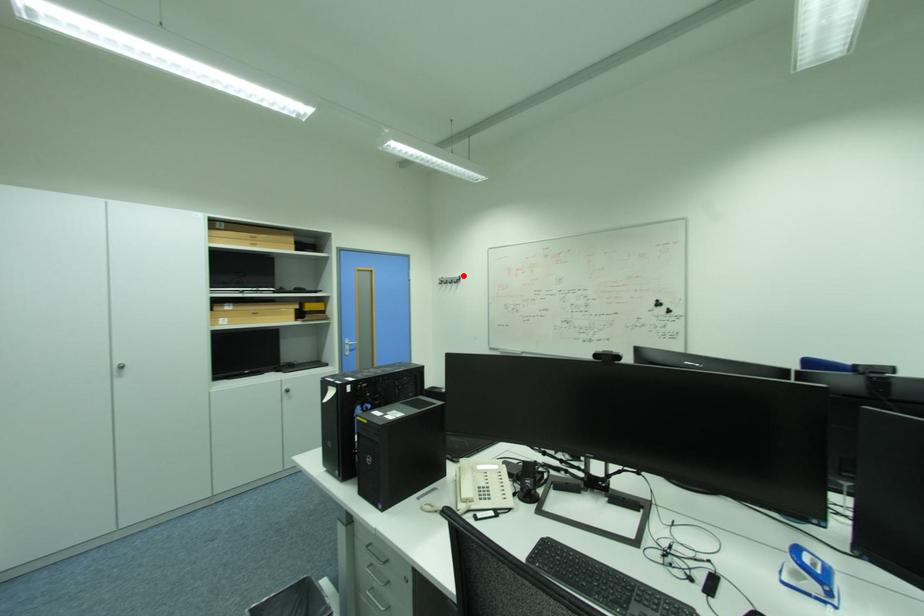
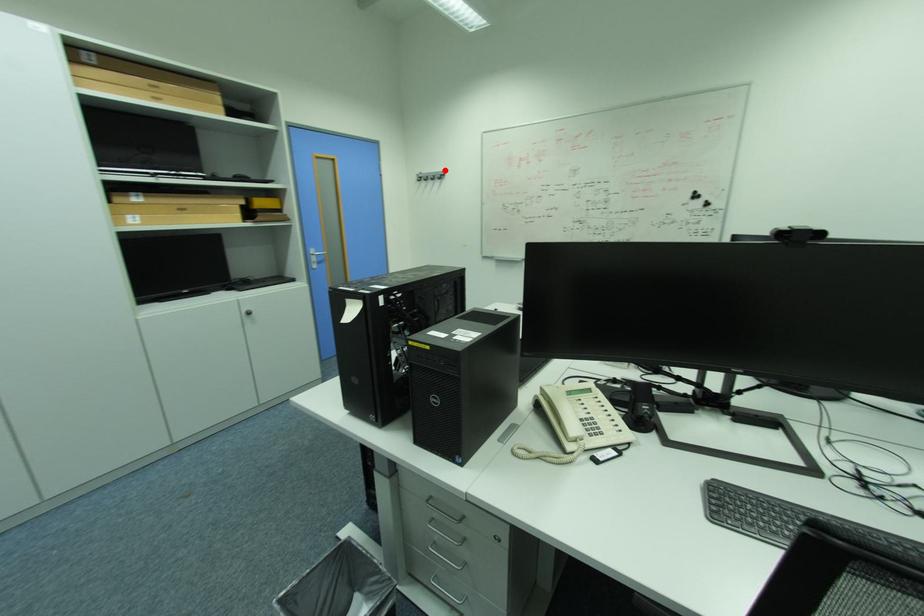
I am providing you with two images of the same scene from different viewpoints. A red point is marked on the first image and another point is marked on the second image. Do the highlighted points in image1 and image2 indicate the same real-world spot?

Yes